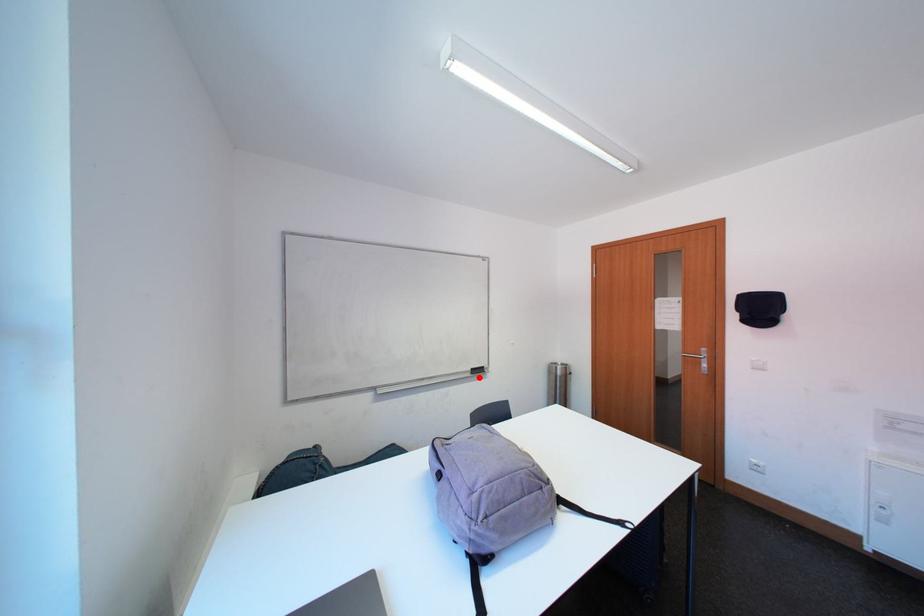
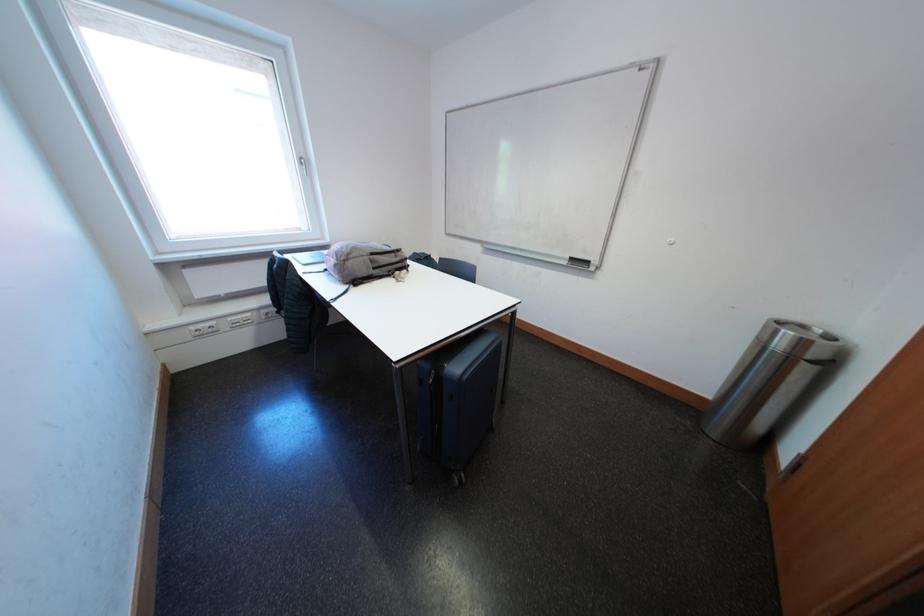
Find the pixel in the second image that matches the highlighted location in the first image.

(575, 267)